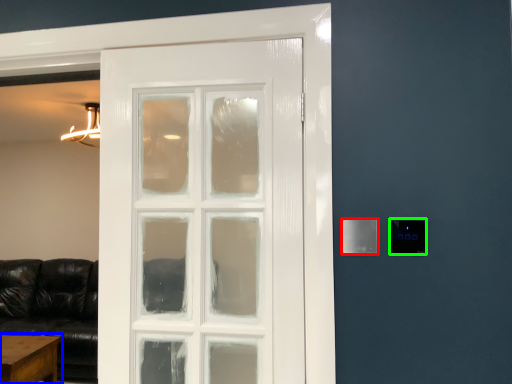
Question: Considering the real-world distances, which object is farthest from light switch (highlighted by a red box)? table (highlighted by a blue box) or light switch (highlighted by a green box)?

Choices:
 (A) table
 (B) light switch

Answer: (A)